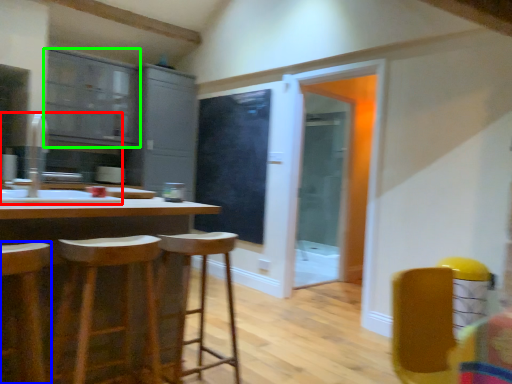
Question: Which object is positioned farthest from sink (highlighted by a red box)? Select from stool (highlighted by a blue box) and cabinetry (highlighted by a green box).

Choices:
 (A) stool
 (B) cabinetry

Answer: (A)